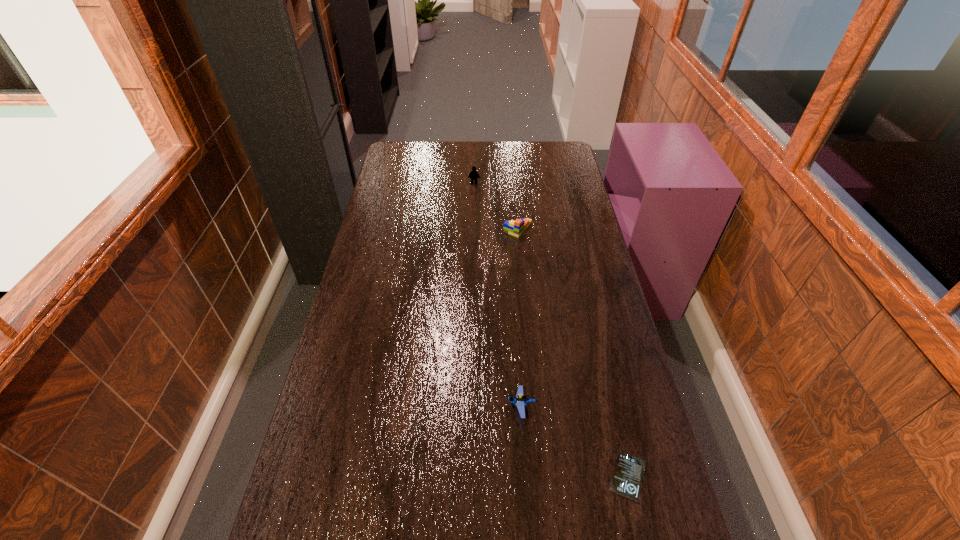
You are a GUI agent. You are given a task and a screenshot of the screen. Output one action in this format:
    pyautogui.click(x=<x>, y=<y>)
    Task: Click on the farthest object
    
    Given the screenshot: What is the action you would take?
    pyautogui.click(x=473, y=174)

Locate an element on the screen. Image resolution: width=960 pixels, height=540 pixels. the leftmost Lego is located at coordinates (x=473, y=174).

Locate an element on the screen. The height and width of the screenshot is (540, 960). the second tallest Lego is located at coordinates (516, 228).

The image size is (960, 540). I want to click on the second farthest Lego, so click(x=516, y=228).

Find the location of a particular element. the third tallest object is located at coordinates (520, 400).

This screenshot has height=540, width=960. Find the location of `the shortest Lego`. the shortest Lego is located at coordinates (520, 400).

This screenshot has width=960, height=540. I want to click on identity card, so click(x=627, y=477).

This screenshot has width=960, height=540. I want to click on the shortest object, so click(627, 477).

Where is `vacant area located 0.330m on the face of the farthest object`? Image resolution: width=960 pixels, height=540 pixels. vacant area located 0.330m on the face of the farthest object is located at coordinates (473, 232).

Find the location of a particular element. The image size is (960, 540). vacant region located 0.160m on the front of the second tallest object is located at coordinates (521, 266).